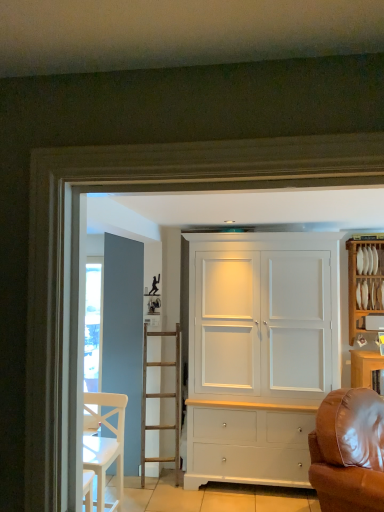
Question: Considering the relative sizes of white wood cabinet at right and white wooden chair at lower left in the image provided, is white wood cabinet at right smaller than white wooden chair at lower left?

Choices:
 (A) no
 (B) yes

Answer: (B)

Question: Does white wood cabinet at right have a larger size compared to white wooden chair at lower left?

Choices:
 (A) yes
 (B) no

Answer: (B)

Question: Are white wood cabinet at right and white wooden chair at lower left far apart?

Choices:
 (A) no
 (B) yes

Answer: (B)

Question: Is white wood cabinet at right positioned with its back to white wooden chair at lower left?

Choices:
 (A) yes
 (B) no

Answer: (B)

Question: Considering the relative sizes of white wood cabinet at right and white wooden chair at lower left in the image provided, is white wood cabinet at right wider than white wooden chair at lower left?

Choices:
 (A) no
 (B) yes

Answer: (A)

Question: Can you confirm if white wood cabinet at right is positioned to the left of white wooden chair at lower left?

Choices:
 (A) no
 (B) yes

Answer: (A)

Question: From a real-world perspective, does white matte cabinet at center stand above white wood cabinet at right?

Choices:
 (A) no
 (B) yes

Answer: (A)

Question: Is white matte cabinet at center taller than white wood cabinet at right?

Choices:
 (A) yes
 (B) no

Answer: (A)

Question: Considering the relative positions of white matte cabinet at center and white wood cabinet at right in the image provided, is white matte cabinet at center to the right of white wood cabinet at right from the viewer's perspective?

Choices:
 (A) no
 (B) yes

Answer: (A)

Question: From the image's perspective, does white matte cabinet at center appear higher than white wood cabinet at right?

Choices:
 (A) yes
 (B) no

Answer: (B)

Question: Considering the relative sizes of white matte cabinet at center and white wood cabinet at right in the image provided, is white matte cabinet at center shorter than white wood cabinet at right?

Choices:
 (A) no
 (B) yes

Answer: (A)

Question: Does white matte cabinet at center turn towards white wood cabinet at right?

Choices:
 (A) no
 (B) yes

Answer: (A)

Question: Is white wooden chair at lower left a part of brown leather couch at right?

Choices:
 (A) no
 (B) yes

Answer: (A)